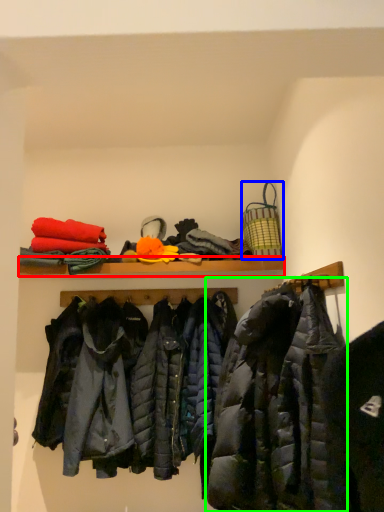
Question: Which object is positioned farthest from shelf (highlighted by a red box)? Select from basket (highlighted by a blue box) and jacket (highlighted by a green box).

Choices:
 (A) basket
 (B) jacket

Answer: (B)